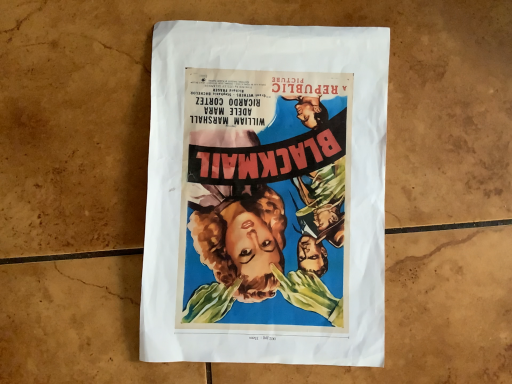
Where is `blank space situated above matte paper poster at center (from a real-world perspective)`? Image resolution: width=512 pixels, height=384 pixels. blank space situated above matte paper poster at center (from a real-world perspective) is located at coordinates (261, 189).